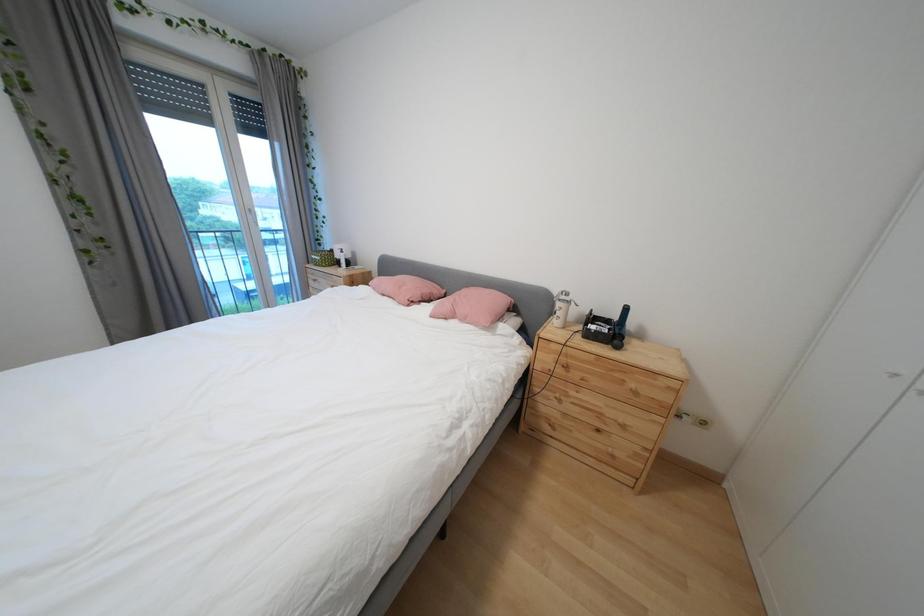
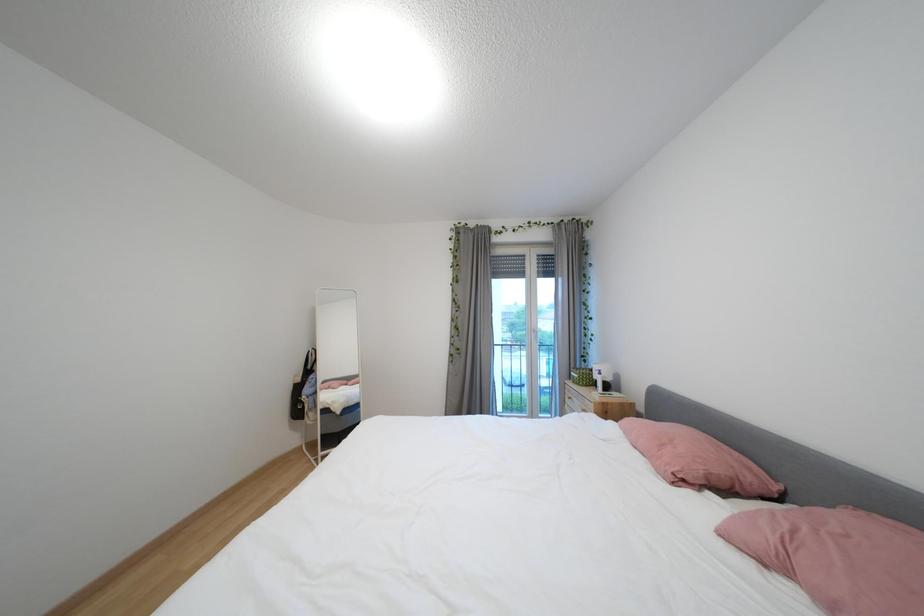
Question: The images are taken continuously from a first-person perspective. In which direction is your viewpoint rotating?

Choices:
 (A) Left
 (B) Right
 (C) Up
 (D) Down

Answer: (A)